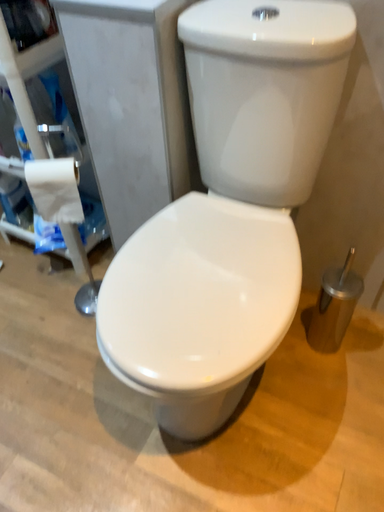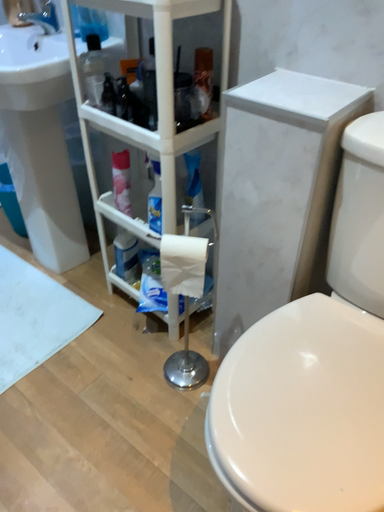
Question: Which way did the camera rotate in the video?

Choices:
 (A) rotated upward
 (B) rotated downward

Answer: (A)